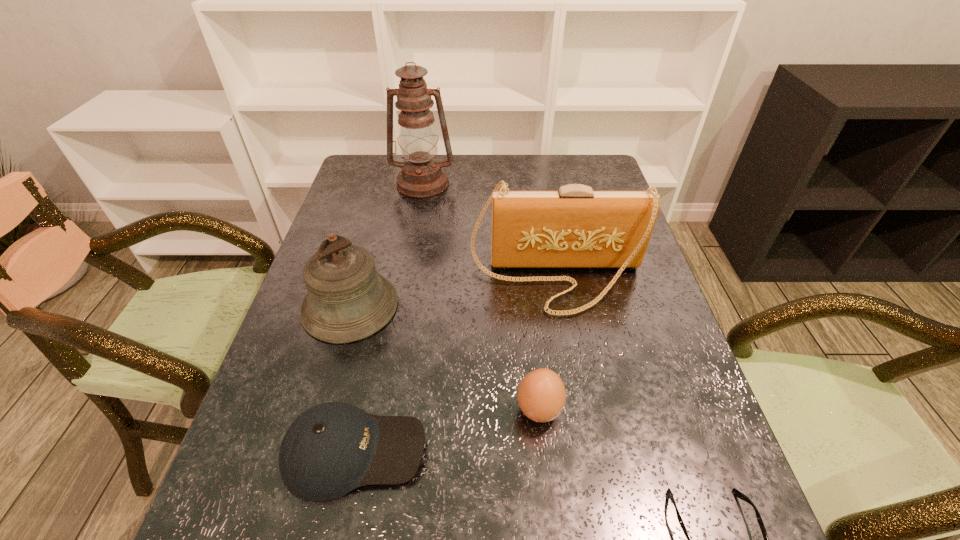
Locate an element on the screen. This screenshot has height=540, width=960. oil lamp is located at coordinates (422, 176).

I want to click on the tallest object, so click(422, 176).

In order to click on handbag in this screenshot , I will do `click(575, 227)`.

You are a GUI agent. You are given a task and a screenshot of the screen. Output one action in this format:
    pyautogui.click(x=<x>, y=<y>)
    Task: Click on the bell
    
    Given the screenshot: What is the action you would take?
    pyautogui.click(x=347, y=301)

Locate an element on the screen. The height and width of the screenshot is (540, 960). the fourth tallest object is located at coordinates (541, 394).

Where is `baseball cap`? The width and height of the screenshot is (960, 540). baseball cap is located at coordinates (332, 448).

This screenshot has width=960, height=540. What are the coordinates of `vacant region located 0.110m on the front of the farthest object` in the screenshot? It's located at (417, 219).

Identify the location of vacant space positioned on the decorative side of the handbag. (567, 341).

Identify the location of vacant space located on the back of the bell. The image size is (960, 540). (384, 188).

In order to click on vacant region located on the back of the boiled egg in this screenshot , I will do `click(526, 291)`.